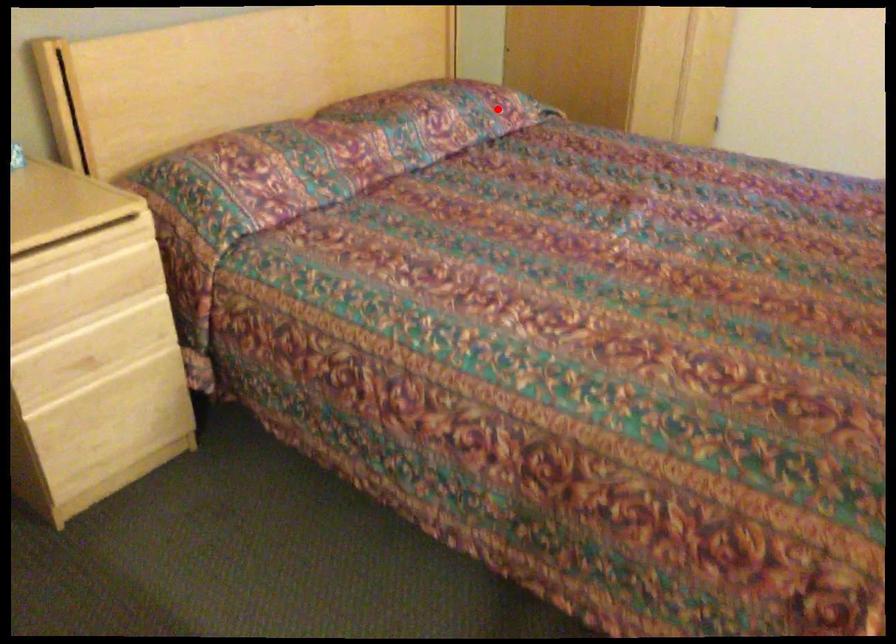
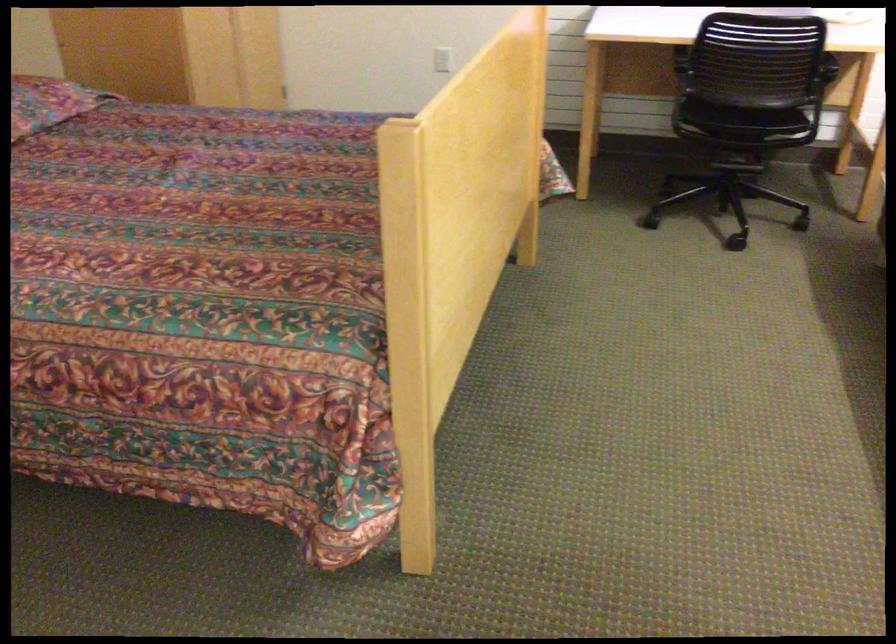
The point at the highlighted location is marked in the first image. Where is the corresponding point in the second image?

(48, 102)